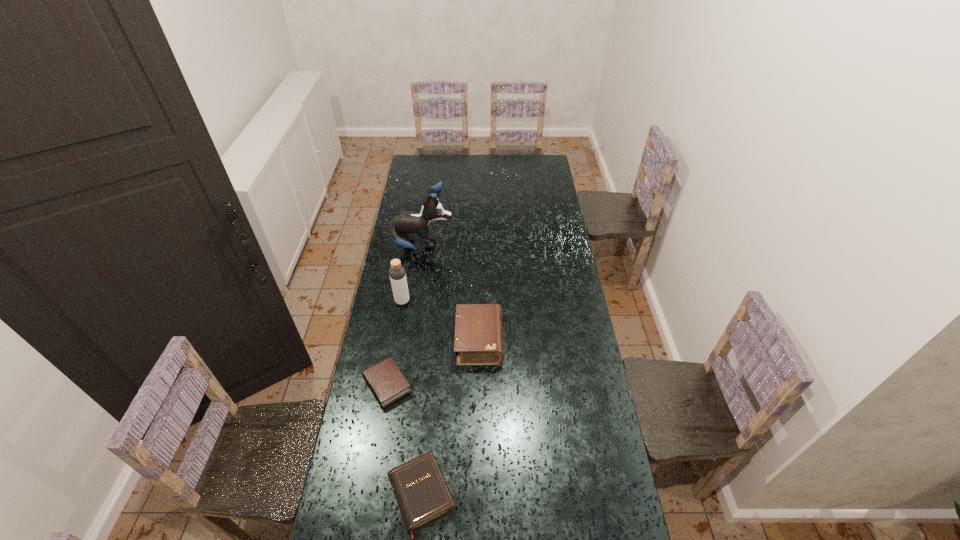
This screenshot has width=960, height=540. Find the location of `the tallest object`. the tallest object is located at coordinates (401, 226).

This screenshot has height=540, width=960. I want to click on the farthest object, so click(401, 226).

Where is `the fourth shortest object`? This screenshot has width=960, height=540. the fourth shortest object is located at coordinates click(397, 273).

Image resolution: width=960 pixels, height=540 pixels. I want to click on bottle, so click(x=397, y=273).

Where is `the tallest Bible`? The image size is (960, 540). the tallest Bible is located at coordinates (478, 340).

You are a GUI agent. You are given a task and a screenshot of the screen. Output one action in this format:
    pyautogui.click(x=<x>, y=<y>)
    Task: Click on the free point located 0.120m on the front-facing side of the farthest object
    
    Given the screenshot: What is the action you would take?
    [477, 246]

You are a GUI agent. You are given a task and a screenshot of the screen. Output one action in this format:
    pyautogui.click(x=<x>, y=<y>)
    Task: Click on the vacant region located on the back of the second tallest object
    
    Given the screenshot: What is the action you would take?
    pyautogui.click(x=405, y=286)

Locate an element on the screen. vacant space located 0.190m on the spine side of the third tallest object is located at coordinates (550, 341).

Find the location of `puppy located at the left edge`. puppy located at the left edge is located at coordinates (401, 226).

This screenshot has width=960, height=540. I want to click on bottle present at the left edge, so click(x=397, y=273).